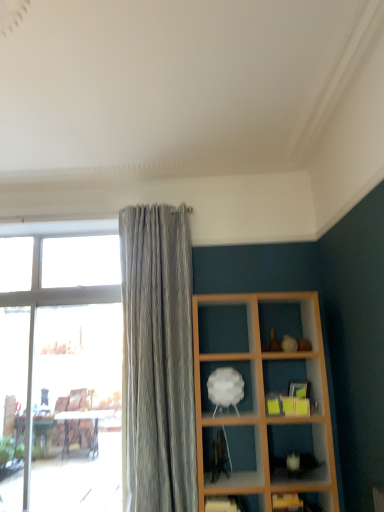
Question: Does transparent glass window at left lie behind wooden shelf at lower right, the first shelf ordered from the bottom?

Choices:
 (A) no
 (B) yes

Answer: (B)

Question: Is transparent glass window at left at the left side of wooden shelf at lower right, the third shelf from the top?

Choices:
 (A) yes
 (B) no

Answer: (A)

Question: Considering the relative sizes of transparent glass window at left and wooden shelf at lower right, the third shelf from the top, in the image provided, is transparent glass window at left thinner than wooden shelf at lower right, the third shelf from the top,?

Choices:
 (A) yes
 (B) no

Answer: (A)

Question: From a real-world perspective, is transparent glass window at left beneath wooden shelf at lower right, the first shelf ordered from the bottom?

Choices:
 (A) yes
 (B) no

Answer: (B)

Question: From a real-world perspective, is transparent glass window at left on top of wooden shelf at lower right, the first shelf ordered from the bottom?

Choices:
 (A) no
 (B) yes

Answer: (B)

Question: Is transparent glass window at left not inside wooden shelf at lower right, the first shelf ordered from the bottom?

Choices:
 (A) no
 (B) yes

Answer: (B)

Question: Is wooden shelf at lower right, the third shelf from the top, thinner than transparent glass window at left?

Choices:
 (A) no
 (B) yes

Answer: (A)

Question: Considering the relative positions of wooden shelf at lower right, the first shelf ordered from the bottom, and transparent glass window at left in the image provided, is wooden shelf at lower right, the first shelf ordered from the bottom, in front of transparent glass window at left?

Choices:
 (A) no
 (B) yes

Answer: (B)

Question: From a real-world perspective, is wooden shelf at lower right, the third shelf from the top, physically below transparent glass window at left?

Choices:
 (A) no
 (B) yes

Answer: (B)

Question: Is the surface of wooden shelf at lower right, the third shelf from the top, in direct contact with transparent glass window at left?

Choices:
 (A) no
 (B) yes

Answer: (A)

Question: Is wooden shelf at lower right, the third shelf from the top, smaller than transparent glass window at left?

Choices:
 (A) yes
 (B) no

Answer: (A)

Question: From a real-world perspective, is wooden shelf at lower right, the first shelf ordered from the bottom, located higher than transparent glass window at left?

Choices:
 (A) no
 (B) yes

Answer: (A)

Question: Is white matte cloud at center, acting as the third shelf starting from the bottom, positioned with its back to transparent glass window at left?

Choices:
 (A) no
 (B) yes

Answer: (A)